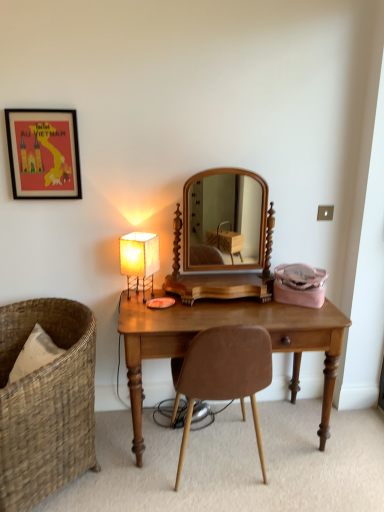
In order to click on vacant space that is in between brown leather chair at center, which is the second chair in left-to-right order, and wooden desk at center in this screenshot , I will do `click(301, 471)`.